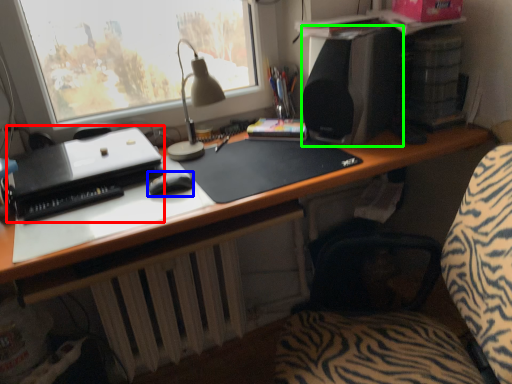
Question: Which object is the farthest from printer (highlighted by a red box)? Choose among these: mouse (highlighted by a blue box) or loudspeaker (highlighted by a green box).

Choices:
 (A) mouse
 (B) loudspeaker

Answer: (B)